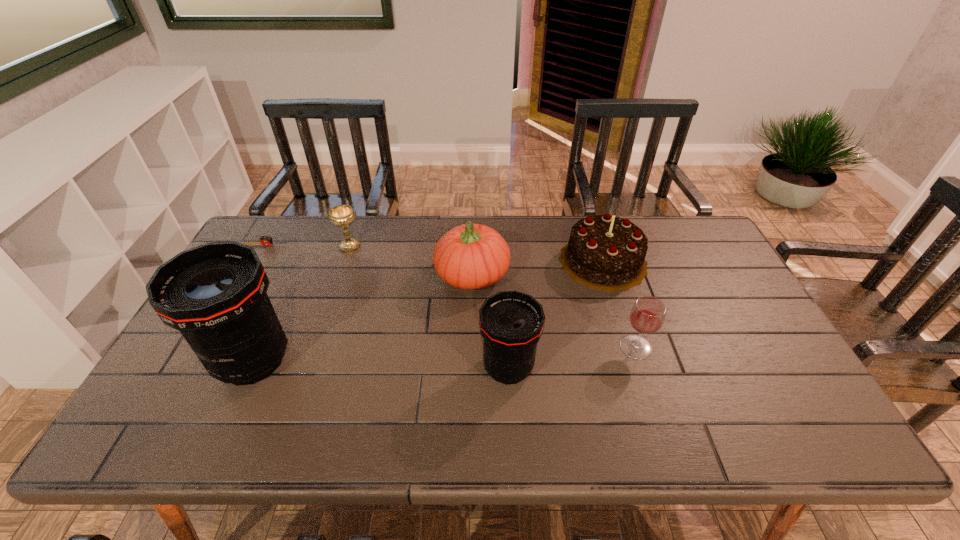
In the current image, all telephoto lenss are evenly spaced. To maintain this equal spacing, where should an additional telephoto lens be placed on the right? Please point out a free spot. Please provide its 2D coordinates. Your answer should be formatted as a tuple, i.e. [(x, y)], where the tuple contains the x and y coordinates of a point satisfying the conditions above.

[(771, 375)]